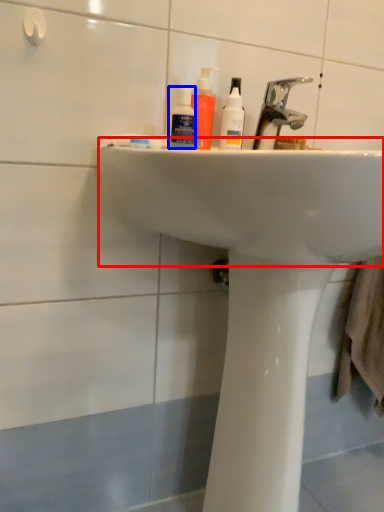
Question: Among these objects, which one is farthest to the camera, sink (highlighted by a red box) or mouthwash (highlighted by a blue box)?

Choices:
 (A) sink
 (B) mouthwash

Answer: (B)